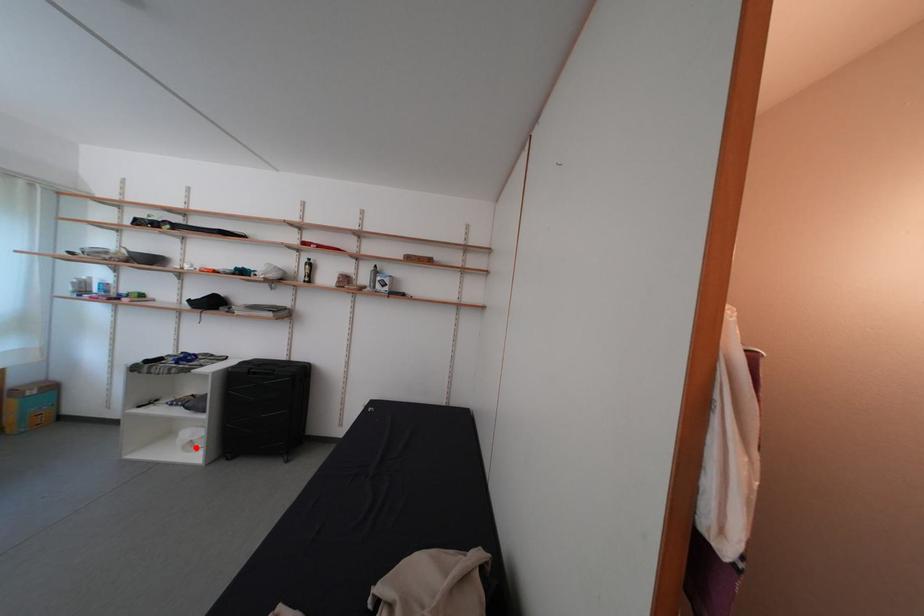
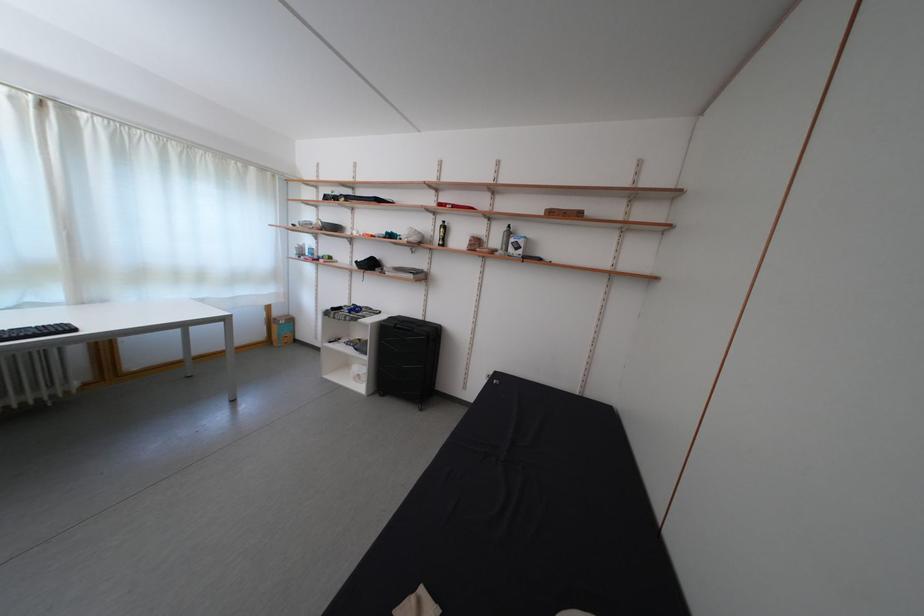
Question: I am providing you with two images of the same scene from different viewpoints. A red point is shown in image1. For the corresponding object point in image2, is it positioned nearer or farther from the camera?

Choices:
 (A) Nearer
 (B) Farther

Answer: (B)